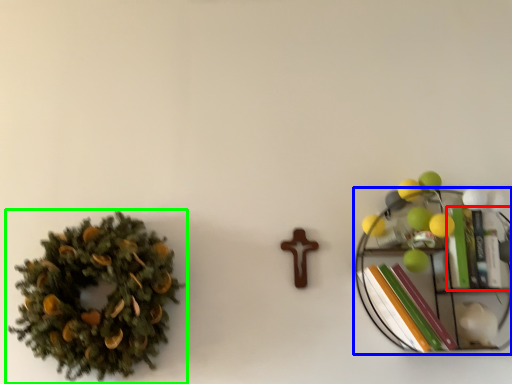
Question: Estimate the real-world distances between objects in this image. Which object is closer to book (highlighted by a red box), shelf (highlighted by a blue box) or houseplant (highlighted by a green box)?

Choices:
 (A) shelf
 (B) houseplant

Answer: (A)